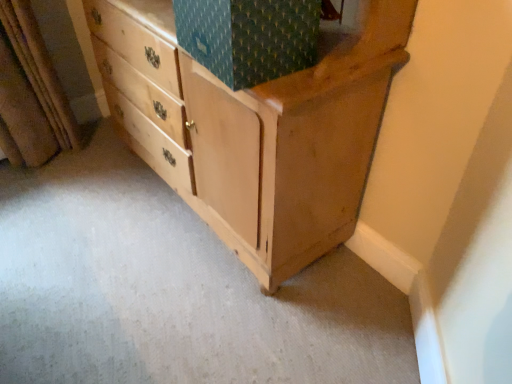
Identify the location of free space in front of light brown wood chest of drawers at lower left. Image resolution: width=512 pixels, height=384 pixels. (200, 312).